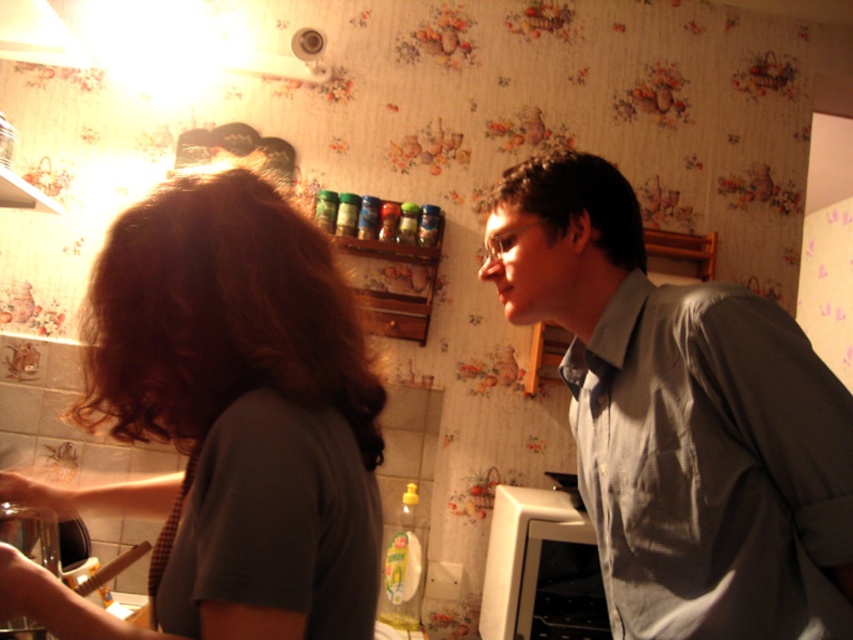
You are standing in the kitchen and need to reach both the gray cotton shirt at right and the white matte oven at lower right. Which object is closer to you?

The gray cotton shirt at right is closer to the viewer than the white matte oven at lower right, so you can reach it first.

In the scene shown: You are standing in the kitchen and want to reach both the point at coordinates (x=637, y=428) and the point at coordinates (x=579, y=632). Which point will you reach first?

You will reach the point at coordinates (x=637, y=428) first because it is closer to you than the point at coordinates (x=579, y=632).

You are a guest in this kitchen and want to wash your hands. The sink is on the left side. There is a dark brown hair at left and a white plastic exhaust hood at upper left. Which object is bigger?

The dark brown hair at left is larger than the white plastic exhaust hood at upper left.